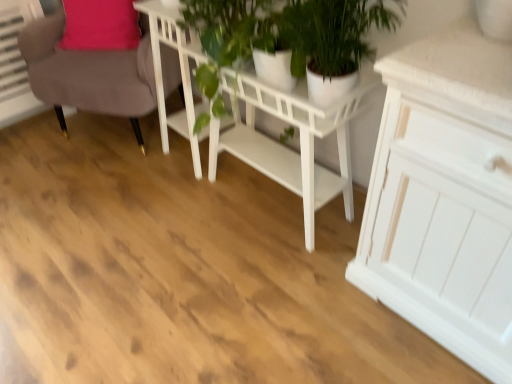
Question: Considering the positions of green leafy plant at center and white wooden table at center, placed as the 1th table when sorted from left to right, in the image, is green leafy plant at center taller or shorter than white wooden table at center, placed as the 1th table when sorted from left to right,?

Choices:
 (A) tall
 (B) short

Answer: (B)

Question: Considering their positions, is green leafy plant at center located in front of or behind white wooden table at center, placed as the second table when sorted from right to left?

Choices:
 (A) front
 (B) behind

Answer: (A)

Question: Which object is positioned closest to the suede-like brown chair at upper left?

Choices:
 (A) green leafy plant at center
 (B) white glossy pot at center
 (C) white wooden table at center, placed as the second table when sorted from right to left
 (D) white glossy table at center, which is counted as the first table, starting from the right

Answer: (C)

Question: Which of these objects is positioned closest to the white glossy table at center, the 2th table viewed from the left?

Choices:
 (A) white wooden table at center, placed as the 1th table when sorted from left to right
 (B) suede-like brown chair at upper left
 (C) green leafy plant at center
 (D) white glossy pot at center

Answer: (A)